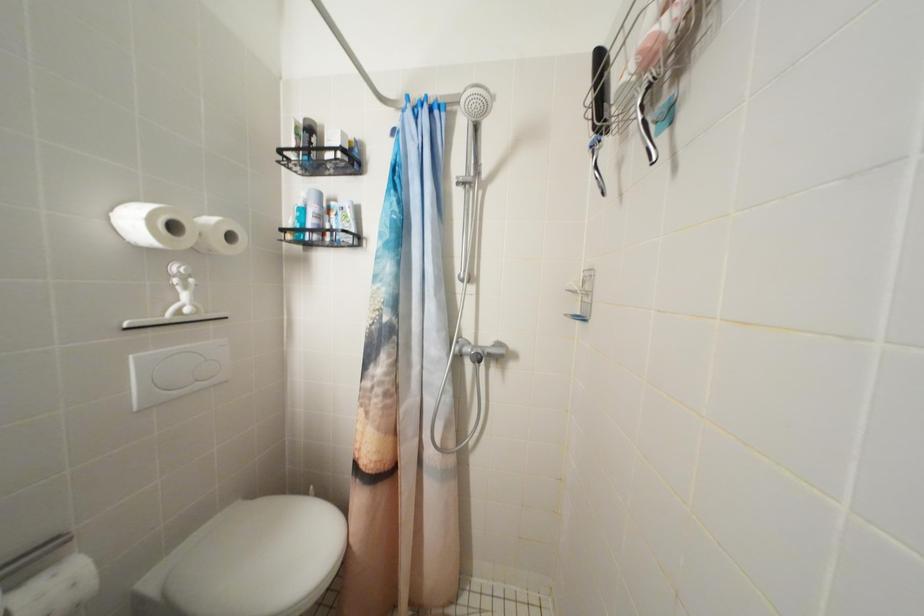
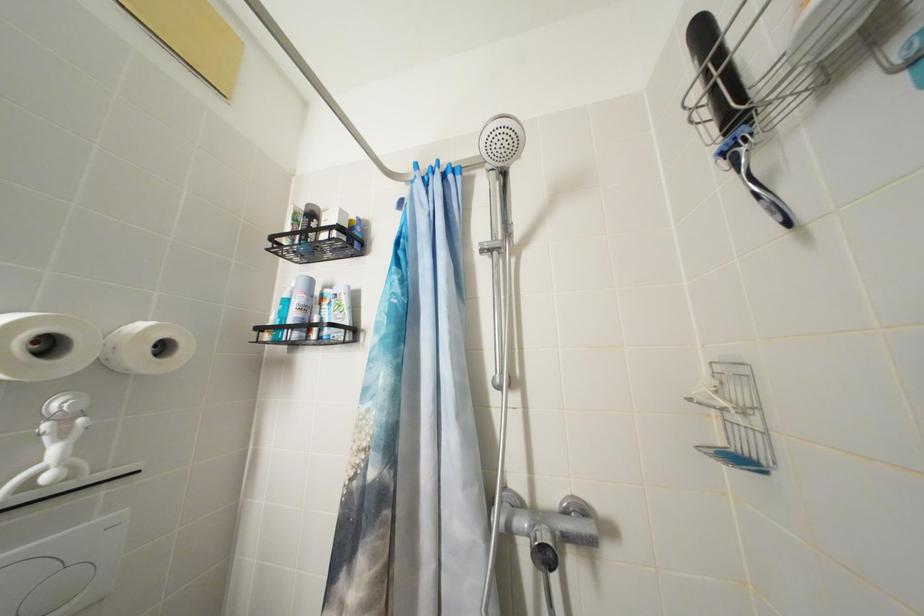
Question: How did the camera likely rotate?

Choices:
 (A) Left
 (B) Right
 (C) Up
 (D) Down

Answer: (C)